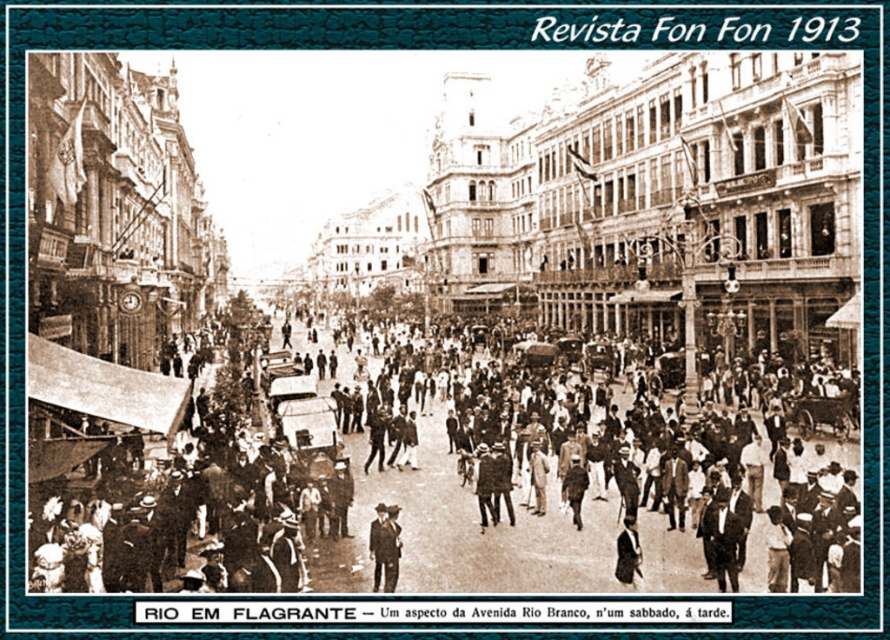
Question: Can you confirm if dark brown suit at center is positioned below dark suit at center?

Choices:
 (A) yes
 (B) no

Answer: (B)

Question: Does dark brown suit at center have a greater width compared to dark suit at center?

Choices:
 (A) yes
 (B) no

Answer: (A)

Question: Is dark brown suit at center below dark suit at center?

Choices:
 (A) yes
 (B) no

Answer: (B)

Question: Among these objects, which one is farthest from the camera?

Choices:
 (A) dark suit at center
 (B) dark brown suit at center

Answer: (A)